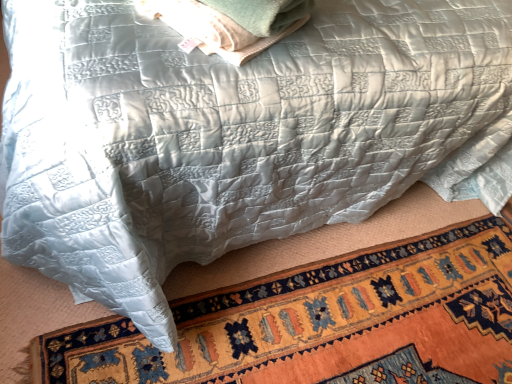
Where is `carpet with intricate patterns at lower center`? The image size is (512, 384). carpet with intricate patterns at lower center is located at coordinates (323, 322).

Describe the element at coordinates (323, 322) in the screenshot. I see `carpet with intricate patterns at lower center` at that location.

Identify the location of carpet with intricate patterns at lower center. (323, 322).